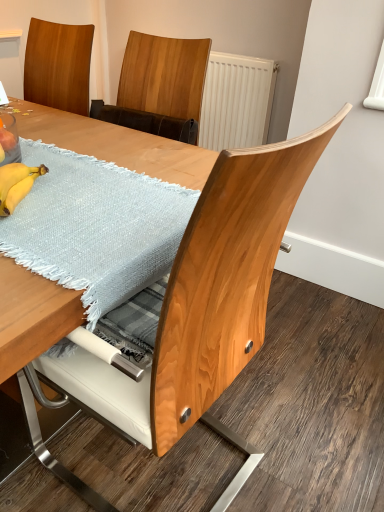
Question: Would you say wooden table at center, the 1th table in the bottom-to-top sequence, contains light blue woven placemat at upper left, positioned as the 2th table in bottom-to-top order?

Choices:
 (A) no
 (B) yes

Answer: (B)

Question: From a real-world perspective, is wooden table at center, the second table when ordered from top to bottom, on light blue woven placemat at upper left, acting as the 1th table starting from the top?

Choices:
 (A) yes
 (B) no

Answer: (B)

Question: Is wooden table at center, the second table when ordered from top to bottom, positioned behind light blue woven placemat at upper left, acting as the 1th table starting from the top?

Choices:
 (A) yes
 (B) no

Answer: (B)

Question: Does wooden table at center, the 1th table in the bottom-to-top sequence, appear on the left side of light blue woven placemat at upper left, acting as the 1th table starting from the top?

Choices:
 (A) no
 (B) yes

Answer: (A)

Question: Is wooden table at center, the 1th table in the bottom-to-top sequence, in front of light blue woven placemat at upper left, acting as the 1th table starting from the top?

Choices:
 (A) yes
 (B) no

Answer: (A)

Question: Is wooden table at center, the 1th table in the bottom-to-top sequence, situated inside light blue woven placemat at upper left, acting as the 1th table starting from the top, or outside?

Choices:
 (A) outside
 (B) inside

Answer: (A)

Question: Is wooden table at center, the 1th table in the bottom-to-top sequence, bigger or smaller than light blue woven placemat at upper left, positioned as the 2th table in bottom-to-top order?

Choices:
 (A) small
 (B) big

Answer: (B)

Question: Is wooden table at center, the 1th table in the bottom-to-top sequence, in front of or behind light blue woven placemat at upper left, positioned as the 2th table in bottom-to-top order, in the image?

Choices:
 (A) behind
 (B) front

Answer: (B)

Question: From a real-world perspective, is wooden table at center, the 1th table in the bottom-to-top sequence, physically located above or below light blue woven placemat at upper left, positioned as the 2th table in bottom-to-top order?

Choices:
 (A) above
 (B) below

Answer: (B)

Question: From a real-world perspective, is light blue woven placemat at upper left, acting as the 1th table starting from the top, physically located above or below wooden table at center, the second table when ordered from top to bottom?

Choices:
 (A) below
 (B) above

Answer: (B)

Question: Would you say light blue woven placemat at upper left, positioned as the 2th table in bottom-to-top order, is to the left or to the right of wooden table at center, the second table when ordered from top to bottom, in the picture?

Choices:
 (A) left
 (B) right

Answer: (A)

Question: From the image's perspective, is light blue woven placemat at upper left, positioned as the 2th table in bottom-to-top order, positioned above or below wooden table at center, the 1th table in the bottom-to-top sequence?

Choices:
 (A) above
 (B) below

Answer: (A)

Question: Is light blue woven placemat at upper left, acting as the 1th table starting from the top, in front of or behind wooden table at center, the second table when ordered from top to bottom, in the image?

Choices:
 (A) behind
 (B) front

Answer: (A)

Question: In the image, is yellow matte bananas at lower left positioned in front of or behind wooden table at center, the second table when ordered from top to bottom?

Choices:
 (A) behind
 (B) front

Answer: (A)

Question: In the image, is yellow matte bananas at lower left on the left side or the right side of wooden table at center, the second table when ordered from top to bottom?

Choices:
 (A) right
 (B) left

Answer: (B)